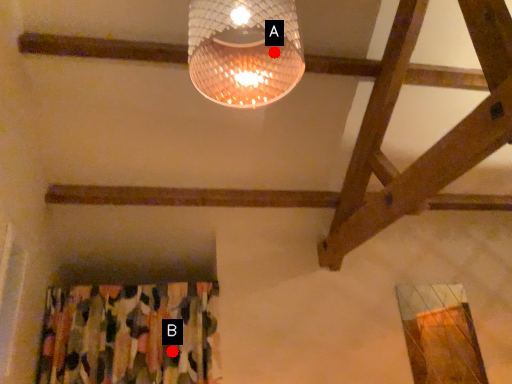
Question: Two points are circled on the image, labeled by A and B beside each circle. Which point is farther to the camera?

Choices:
 (A) A is further
 (B) B is further

Answer: (B)